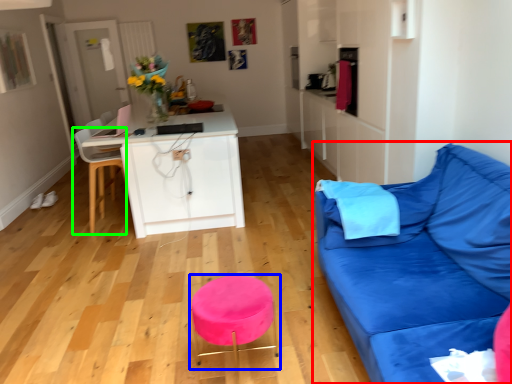
Question: Estimate the real-world distances between objects in this image. Which object is farther from studio couch (highlighted by a red box), bar stool (highlighted by a blue box) or chair (highlighted by a green box)?

Choices:
 (A) bar stool
 (B) chair

Answer: (B)